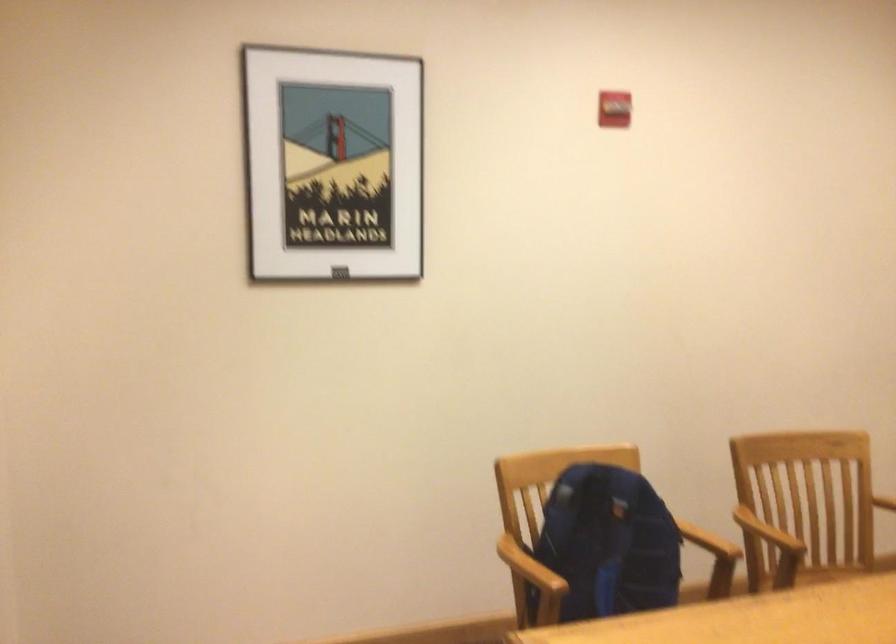
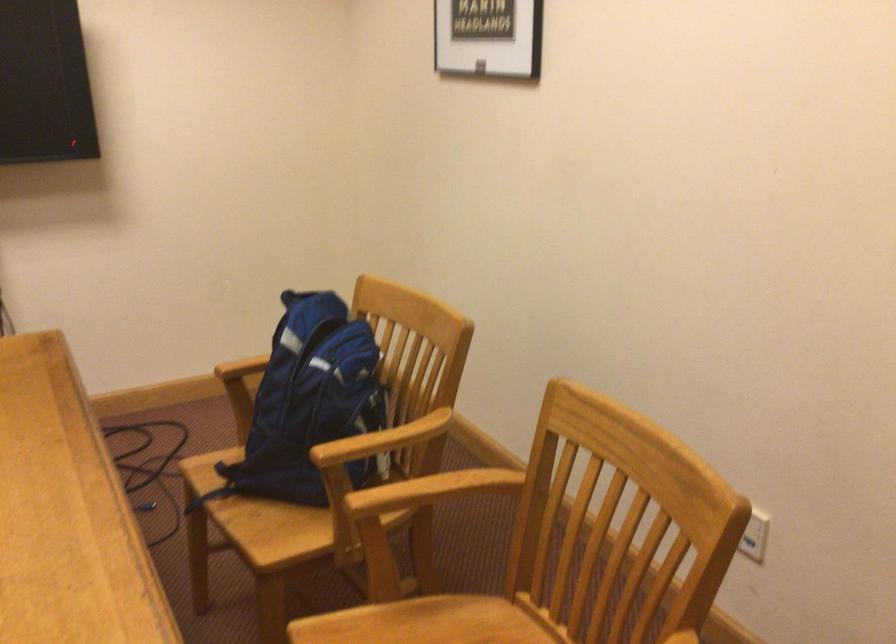
Find the pixel in the second image that matches [754,534] in the first image.

(436, 488)